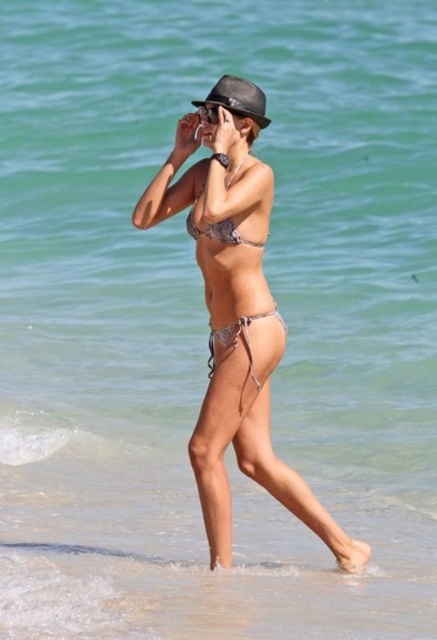
Question: Which point appears farthest from the camera in this image?

Choices:
 (A) [211, 228]
 (B) [267, 124]
 (C) [232, 330]
 (D) [214, 106]

Answer: (D)

Question: Can you confirm if metallic bikini at center is positioned above shiny silver bikini top at center?

Choices:
 (A) no
 (B) yes

Answer: (A)

Question: Which point is farther to the camera?

Choices:
 (A) (252, 317)
 (B) (231, 173)
 (C) (196, 106)
 (D) (228, 234)

Answer: (C)

Question: Which point is closer to the camera?

Choices:
 (A) (204, 230)
 (B) (236, 230)
 (C) (305, 524)

Answer: (B)

Question: Does shiny metallic bikini at center appear on the right side of shiny silver bikini top at center?

Choices:
 (A) no
 (B) yes

Answer: (B)

Question: From the image, what is the correct spatial relationship of shiny metallic bikini at center in relation to matte black fedora at upper center?

Choices:
 (A) right
 (B) left

Answer: (B)